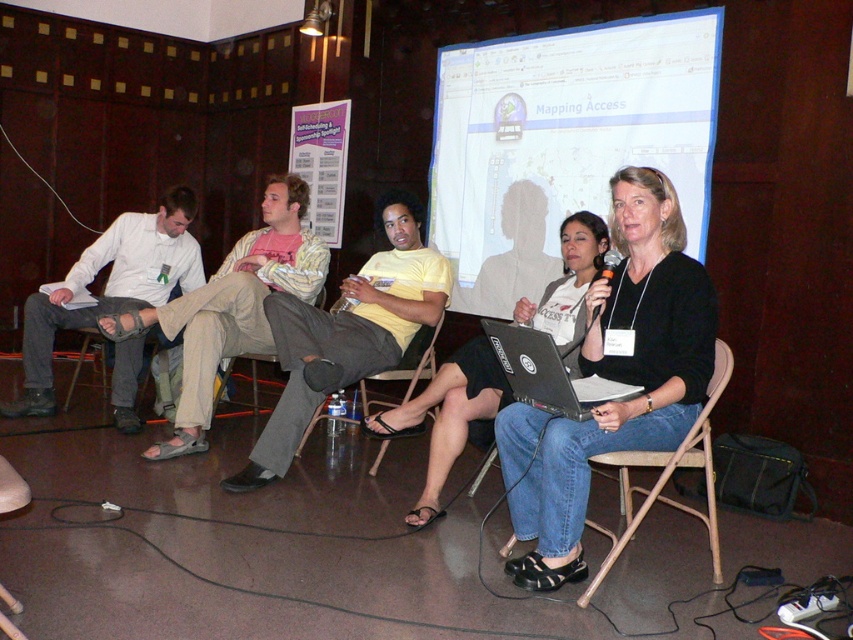
Consider the image. Can you confirm if tan sandal at center is thinner than black fabric chair at center?

Incorrect, tan sandal at center's width is not less than black fabric chair at center's.

In order to click on tan sandal at center in this screenshot , I will do `click(231, 307)`.

Can you confirm if white matte projection screen at upper center is shorter than black plastic laptop at center?

Incorrect, white matte projection screen at upper center's height does not fall short of black plastic laptop at center's.

Find the location of a particular element. white matte projection screen at upper center is located at coordinates click(563, 141).

Identify the location of white matte projection screen at upper center. This screenshot has width=853, height=640. (563, 141).

Looking at this image, can you confirm if white shirt at left is positioned to the left of black plastic laptop at center?

Correct, you'll find white shirt at left to the left of black plastic laptop at center.

Which is behind, point (115, 385) or point (526, 333)?

Point (115, 385)

Does point (160, 221) lie in front of point (560, 413)?

No, it is behind (560, 413).

This screenshot has width=853, height=640. What are the coordinates of `white shirt at left` in the screenshot? It's located at (109, 288).